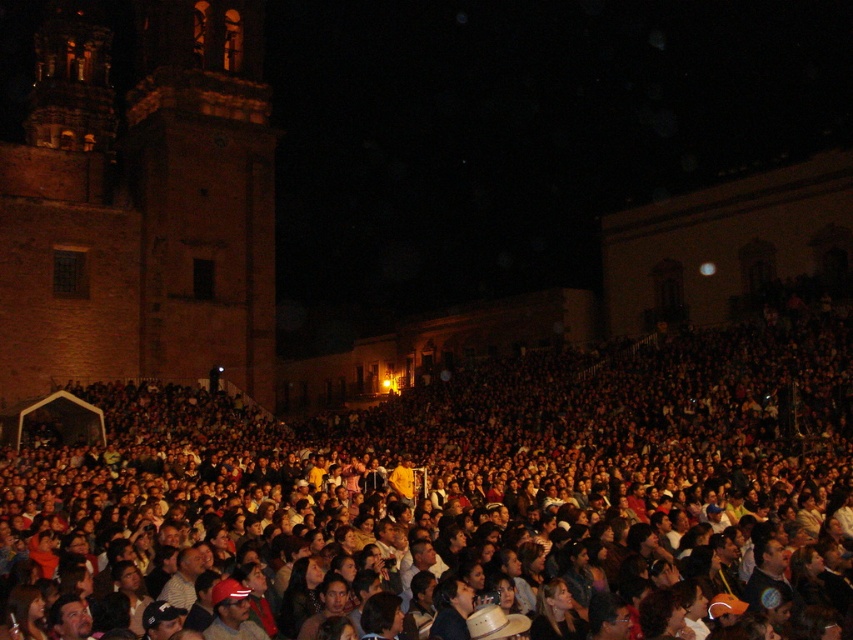
You are a photographer at the event and want to capture a photo that includes both the dark brown hair at center and the brick church at left. Considering their heights, which object should you focus on first to ensure both are in frame?

The dark brown hair at center has a lesser height compared to the brick church at left, so you should focus on the brick church at left first to ensure both are in frame.

You are a photographer trying to capture the crowd and the buildings in the background. You want to ensure that both the dark brown hair at center and the brick church at left are visible in your shot. Based on their sizes, which object should you focus on to include both in the frame?

dark brown hair at center is wider than brick church at left, so focusing on the dark brown hair at center would ensure both are visible as it occupies more space in the frame.